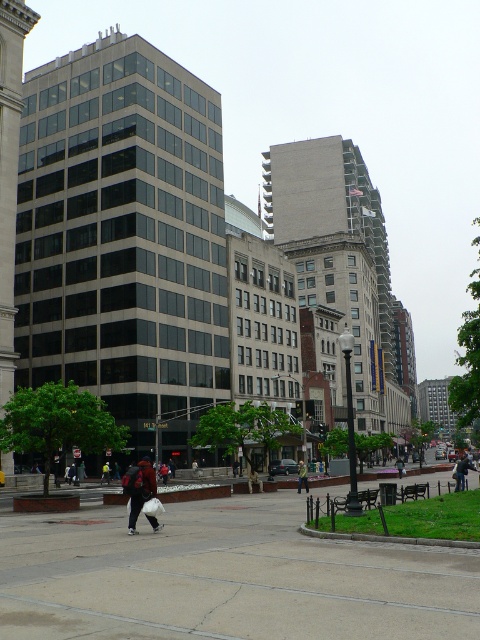
You are standing at the point with coordinates (139, 488) in the image. What object is located at that point?

The point at (139, 488) corresponds to the dark brown leather backpack at center.

You are a delivery person who needs to retrieve the dark brown leather backpack at center and the dark gray jacket at center from the plaza. Which item is positioned higher up relative to the other?

The dark brown leather backpack at center is located above the dark gray jacket at center, so it is positioned higher up.

You are standing at the edge of the plaza and want to know the distance between the green fabric jacket at center and the dark gray jacket at center. Can you estimate how far apart they are?

The green fabric jacket at center is 48.14 feet away from the dark gray jacket at center, so they are approximately 48.14 feet apart.